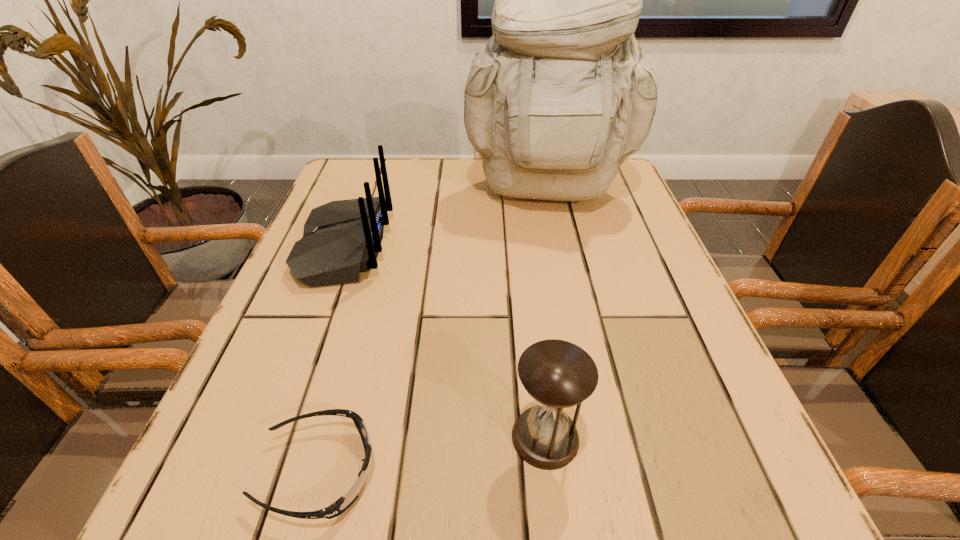
Where is `blank area in the image that satisfies the following two spatial constraints: 1. on the front-facing side of the backpack; 2. on the back of the third shortest object`? This screenshot has height=540, width=960. blank area in the image that satisfies the following two spatial constraints: 1. on the front-facing side of the backpack; 2. on the back of the third shortest object is located at coordinates (559, 247).